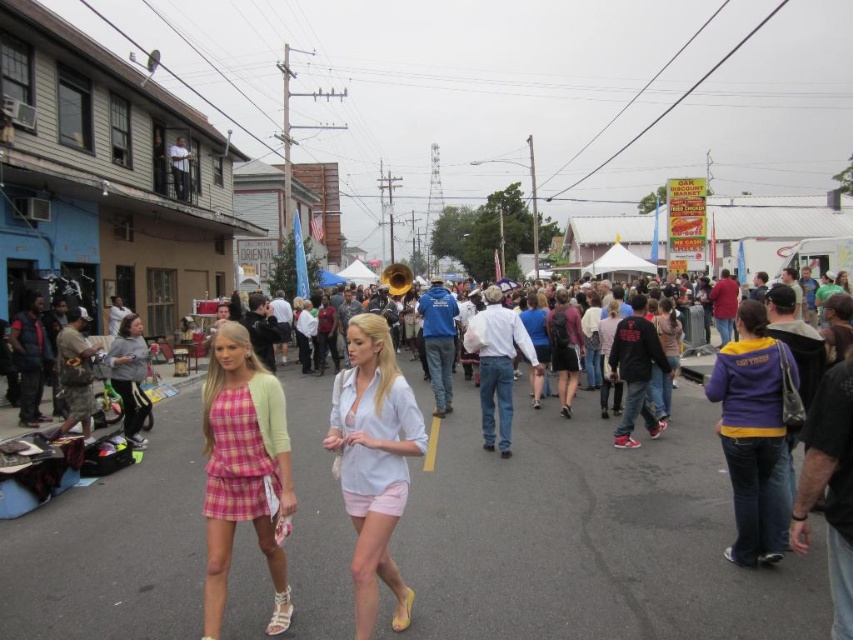
You are standing in the middle of the lively street scene and want to take a photo. There are two points of interest marked as point 1 at coordinates point (x=227, y=336) and point 2 at coordinates point (x=726, y=369). Which point should you focus on to capture the subject that is closer to you?

Point 1 at coordinates point (x=227, y=336) is closer to the camera than point 2 at coordinates point (x=726, y=369), so you should focus on point 1 to capture the subject that is closer to you.